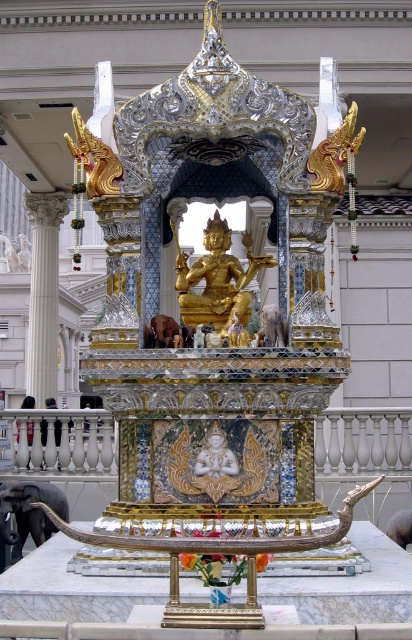
Which is more to the left, gold polished statue at center or white marble column at left?

white marble column at left is more to the left.

At what (x,y) coordinates should I click in order to perform the action: click on gold polished statue at center. Please return your answer as a coordinate pair (x, y). Looking at the image, I should click on (217, 282).